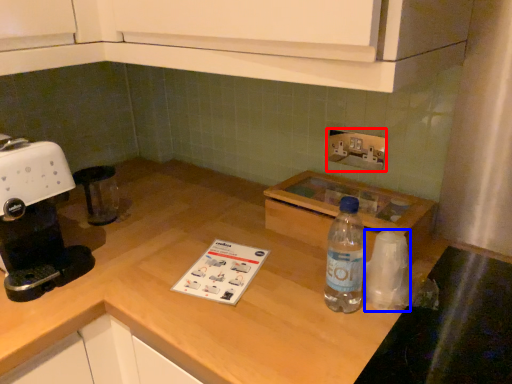
Question: Which object is closer to the camera taking this photo, electric outlet (highlighted by a red box) or paper towel (highlighted by a blue box)?

Choices:
 (A) electric outlet
 (B) paper towel

Answer: (B)